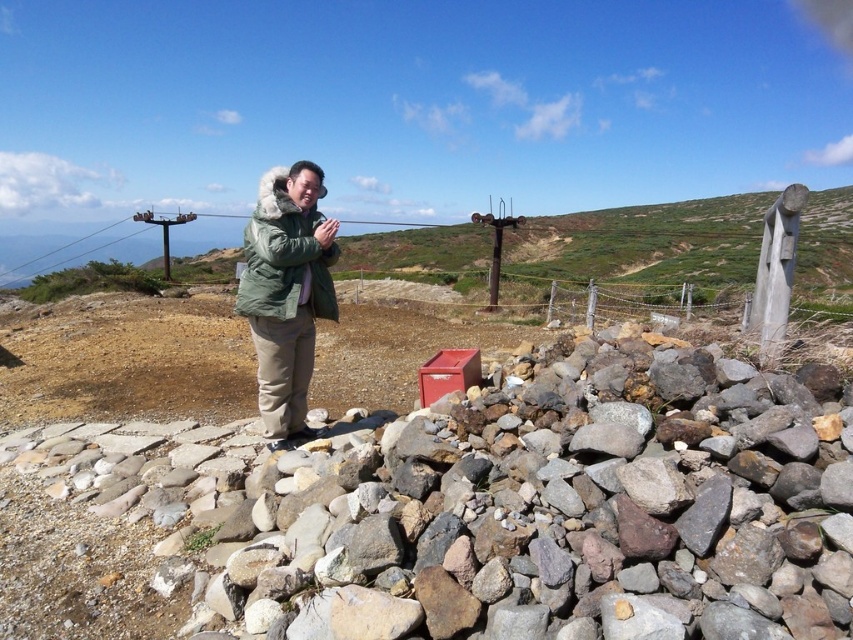
Question: Can you confirm if green grassy hillside at center is positioned above red matte cooler at center?

Choices:
 (A) no
 (B) yes

Answer: (B)

Question: Is green grassy hillside at center behind green fuzzy coat at center?

Choices:
 (A) yes
 (B) no

Answer: (B)

Question: Which object is positioned farthest from the green grassy hillside at center?

Choices:
 (A) red matte cooler at center
 (B) green fuzzy coat at center
 (C) smooth gray rock at center

Answer: (B)

Question: Estimate the real-world distances between objects in this image. Which object is closer to the green grassy hillside at center?

Choices:
 (A) smooth gray rock at center
 (B) green fuzzy coat at center

Answer: (A)

Question: Considering the real-world distances, which object is farthest from the green grassy hillside at center?

Choices:
 (A) red matte cooler at center
 (B) green fuzzy coat at center

Answer: (B)

Question: Does green grassy hillside at center lie behind green fuzzy coat at center?

Choices:
 (A) yes
 (B) no

Answer: (B)